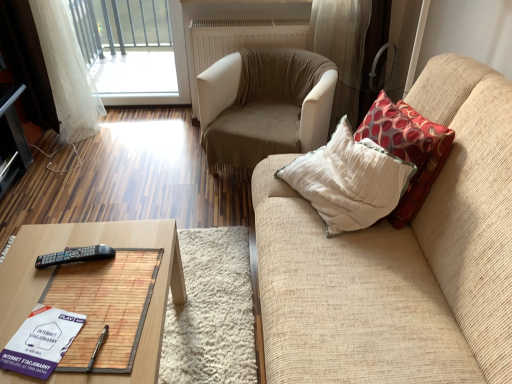
Locate an element on the screen. The image size is (512, 384). free space to the back side of purple paper book at lower left is located at coordinates (67, 293).